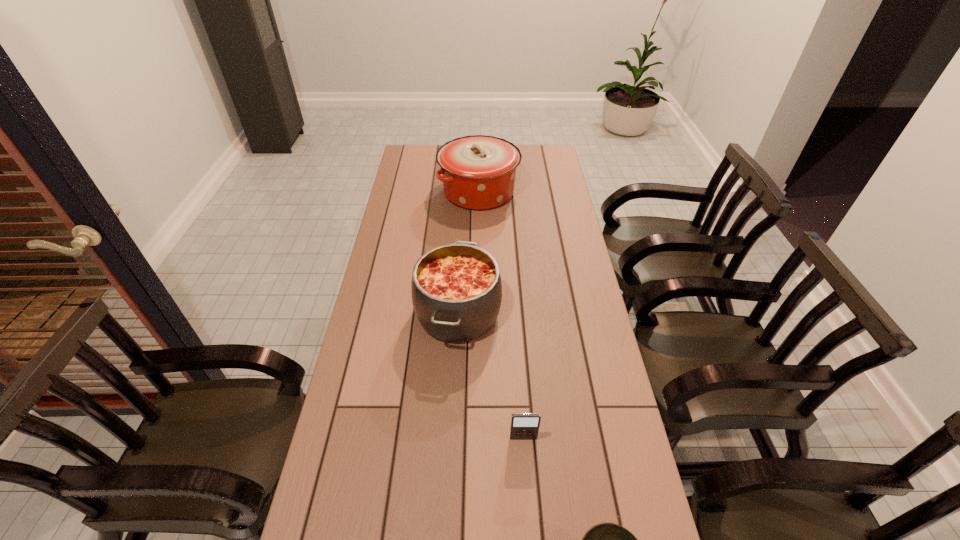
Identify the location of the tallest object. (478, 172).

This screenshot has height=540, width=960. I want to click on the farther casserole, so click(478, 172).

Locate an element on the screen. The width and height of the screenshot is (960, 540). the shorter casserole is located at coordinates (456, 288).

What are the coordinates of `the second farthest object` in the screenshot? It's located at (456, 288).

This screenshot has width=960, height=540. In order to click on the second shortest object in this screenshot , I will do `click(524, 426)`.

The width and height of the screenshot is (960, 540). What are the coordinates of `the second nearest object` in the screenshot? It's located at (524, 426).

You are a GUI agent. You are given a task and a screenshot of the screen. Output one action in this format:
    pyautogui.click(x=<x>, y=<y>)
    Task: Click on the free region located on the right of the taller casserole
    This screenshot has width=960, height=540.
    Given the screenshot: What is the action you would take?
    pyautogui.click(x=538, y=192)

This screenshot has width=960, height=540. I want to click on free space located 0.060m on the back of the nearer casserole, so click(x=461, y=264).

This screenshot has width=960, height=540. In order to click on free space located 0.200m on the front-facing side of the second nearest object in this screenshot , I will do `click(530, 528)`.

This screenshot has height=540, width=960. I want to click on vacant space at the left edge, so click(371, 525).